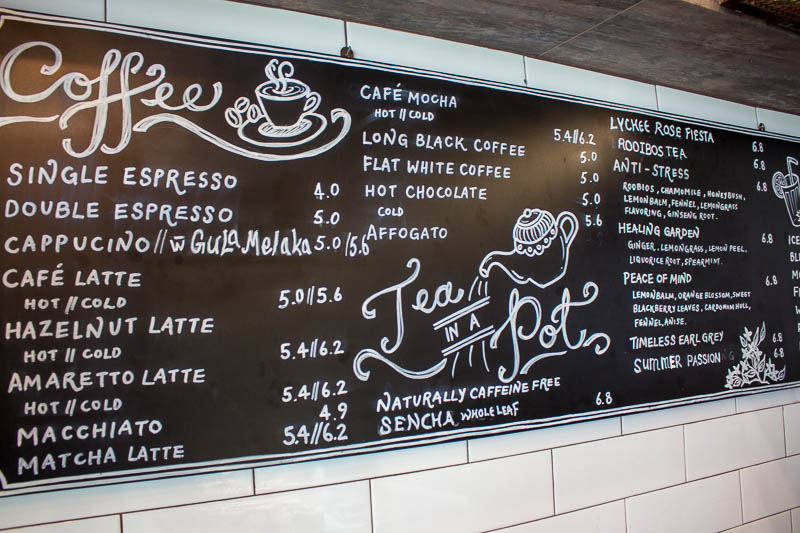
Find the location of a particular element. The image size is (800, 533). teapot is located at coordinates (557, 258).